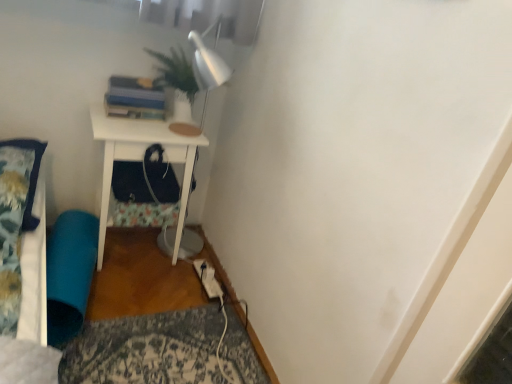
What are the coordinates of `empty space that is ontop of white matte nightstand at center` in the screenshot? It's located at (152, 121).